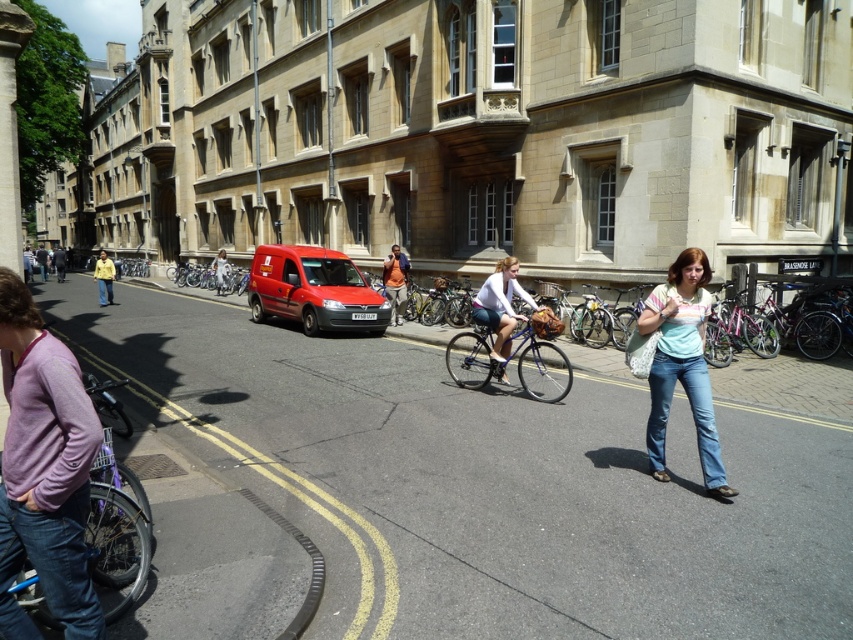
You are standing at the point with coordinates 0.5, 0.5 in the image. Which direction should you move to reach the blue metallic bicycle at center?

Since the blue metallic bicycle at center is located at coordinates (x=508, y=362), you should move northeast from your current position at (x=426, y=320) to reach it.

You are a delivery person trying to park your matte white bicycle at center near the matte red van at center. Based on the scene, can you safely park your bicycle there without it being obstructed by the van?

The matte red van at center is positioned over the matte white bicycle at center, so parking the bicycle there would result in it being obstructed by the van.